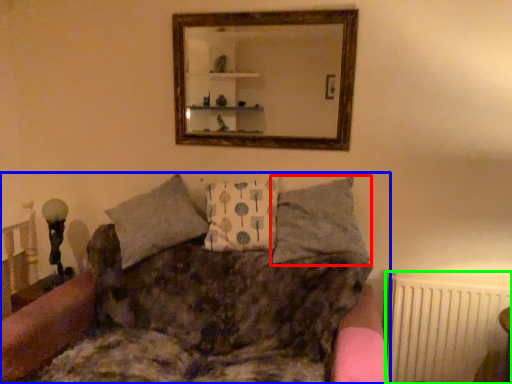
Question: Which object is positioned closest to pillow (highlighted by a red box)? Select from studio couch (highlighted by a blue box) and radiator (highlighted by a green box).

Choices:
 (A) studio couch
 (B) radiator

Answer: (A)